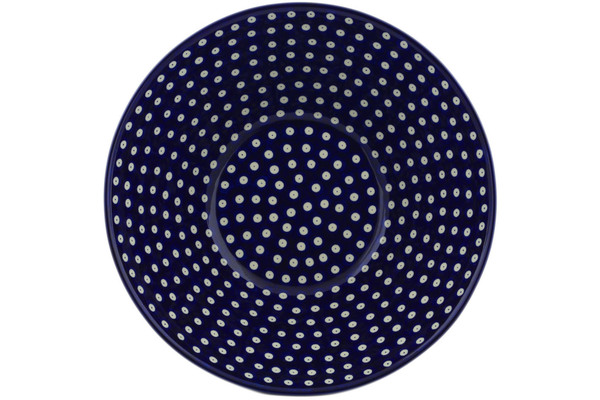
This screenshot has width=600, height=400. I want to click on bottom edge of plate, so click(x=297, y=393).